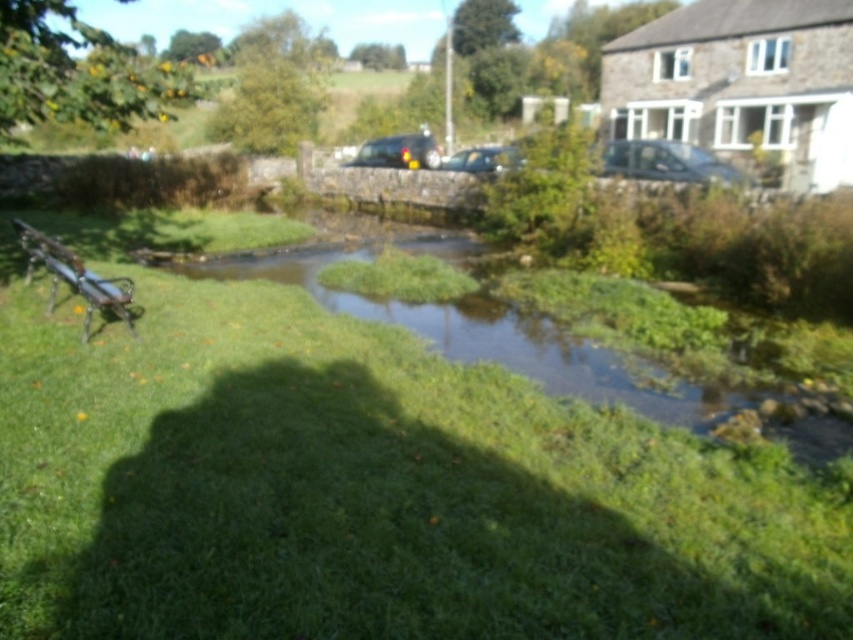
Based on the photo, you are a visitor at the park and want to sit on the metallic park bench at left. From your current position at the green grass at center, which direction should you move to reach the bench?

The green grass at center is below the metallic park bench at left, so you should move upwards to reach the bench.

You are standing at the point marked by the coordinates point (369, 490) in the image. What is the immediate surface you are standing on?

The immediate surface you are standing on is the green grass at center marked by point (369, 490).

You are a gardener who needs to water the green grass at center from the metallic park bench at left. The watering can you have can only hold enough water to cover 5 meters. Do you think you can water the grass without needing to refill the can?

The green grass at center is 5.61 meters from the metallic park bench at left. Since the watering can can only cover 5 meters, you will need to refill the can before finishing the job.